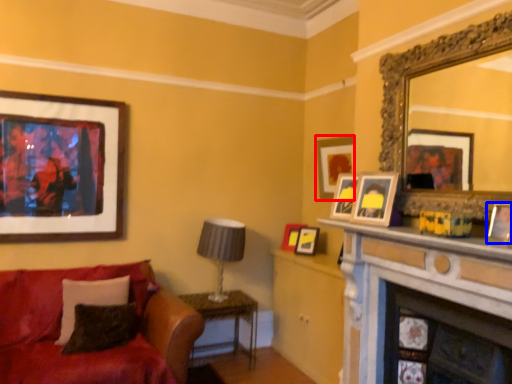
Question: Which object is closer to the camera taking this photo, picture frame (highlighted by a red box) or picture frame (highlighted by a blue box)?

Choices:
 (A) picture frame
 (B) picture frame

Answer: (B)